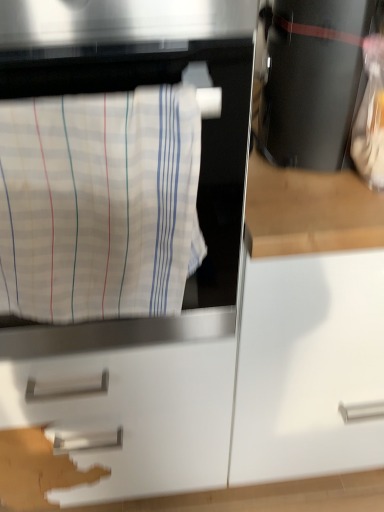
Question: Considering their positions, is white matte drawer at center located in front of or behind black glossy coffee maker at upper right?

Choices:
 (A) behind
 (B) front

Answer: (A)

Question: Considering the positions of white matte drawer at center and black glossy coffee maker at upper right in the image, is white matte drawer at center taller or shorter than black glossy coffee maker at upper right?

Choices:
 (A) tall
 (B) short

Answer: (A)

Question: Based on their relative distances, which object is nearer to the black glossy coffee maker at upper right?

Choices:
 (A) white striped fabric at left
 (B) white matte drawer at center

Answer: (A)

Question: Considering the real-world distances, which object is closest to the white matte drawer at center?

Choices:
 (A) white striped fabric at left
 (B) black glossy coffee maker at upper right

Answer: (A)